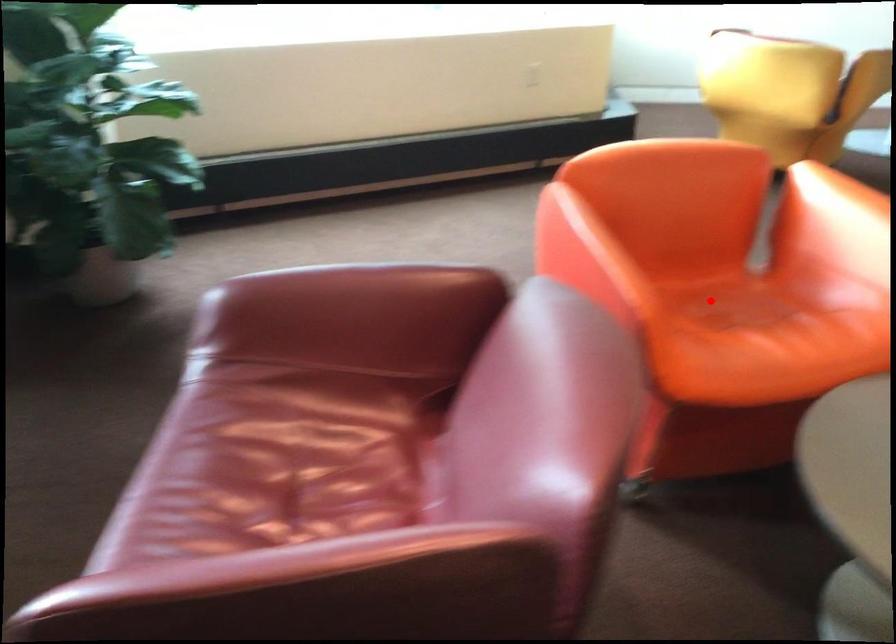
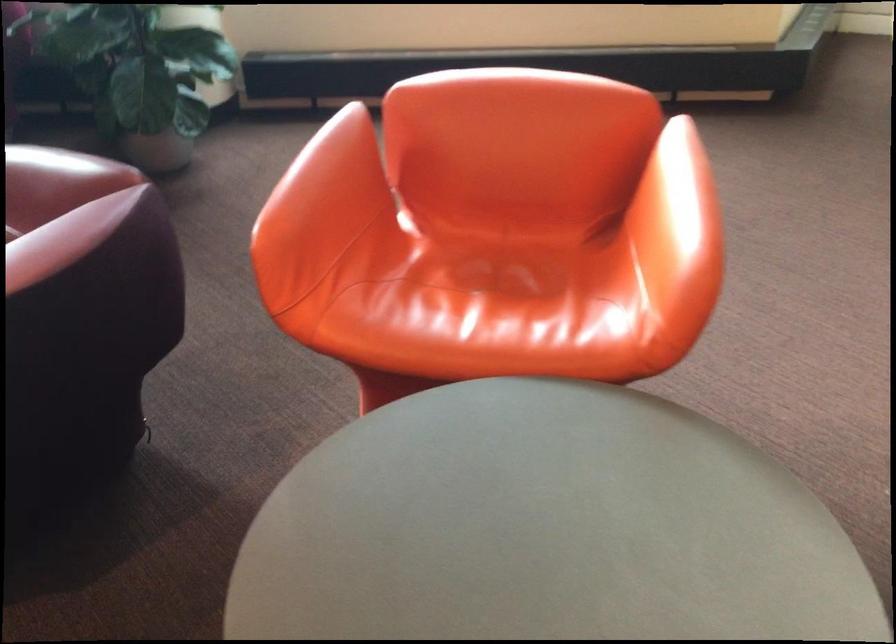
Question: I am providing you with two images of the same scene from different viewpoints. Image1 has a red point marked. In image2, the corresponding 3D location appears at what relative position? Reply with the corresponding letter.

Choices:
 (A) Closer
 (B) Farther

Answer: (A)